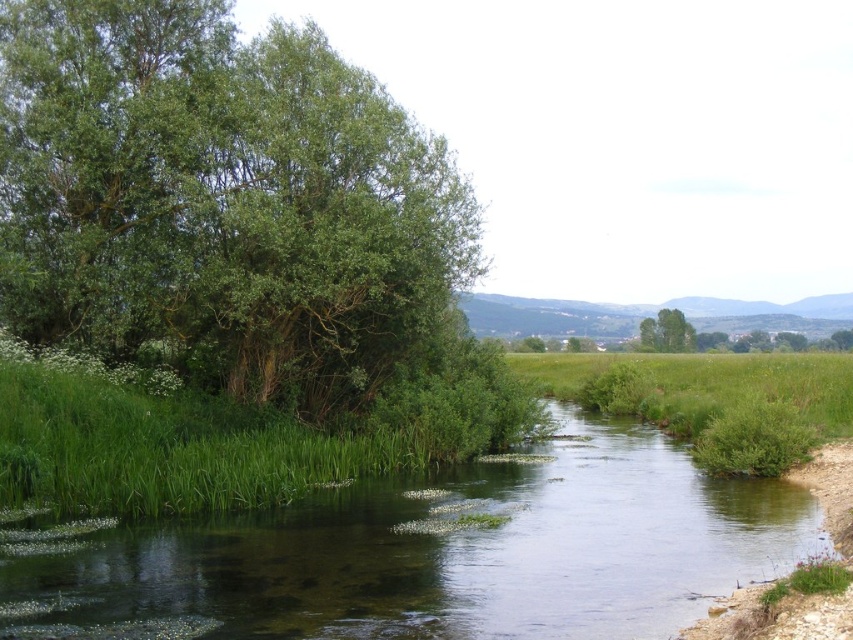
Can you confirm if green leafy tree at left is taller than green leafy tree at center?

Yes.

Does green leafy tree at left have a lesser width compared to green leafy tree at center?

No.

Is point (73, 243) in front of point (676, 340)?

That is True.

This screenshot has width=853, height=640. Identify the location of green leafy tree at left. (219, 202).

Looking at this image, who is taller, green leafy tree at left or green grassy river at center?

green leafy tree at left is taller.

Can you confirm if green leafy tree at left is positioned above green grassy river at center?

Indeed, green leafy tree at left is positioned over green grassy river at center.

Which is behind, point (277, 163) or point (647, 548)?

The point (277, 163) is more distant.

Image resolution: width=853 pixels, height=640 pixels. Identify the location of green leafy tree at left. (219, 202).

What do you see at coordinates (440, 554) in the screenshot? This screenshot has height=640, width=853. I see `green grassy river at center` at bounding box center [440, 554].

Does green grassy river at center have a smaller size compared to green leafy tree at center?

Incorrect, green grassy river at center is not smaller in size than green leafy tree at center.

Is point (86, 548) more distant than point (689, 333)?

No, (86, 548) is closer to viewer.

Locate an element on the screen. Image resolution: width=853 pixels, height=640 pixels. green grassy river at center is located at coordinates (440, 554).